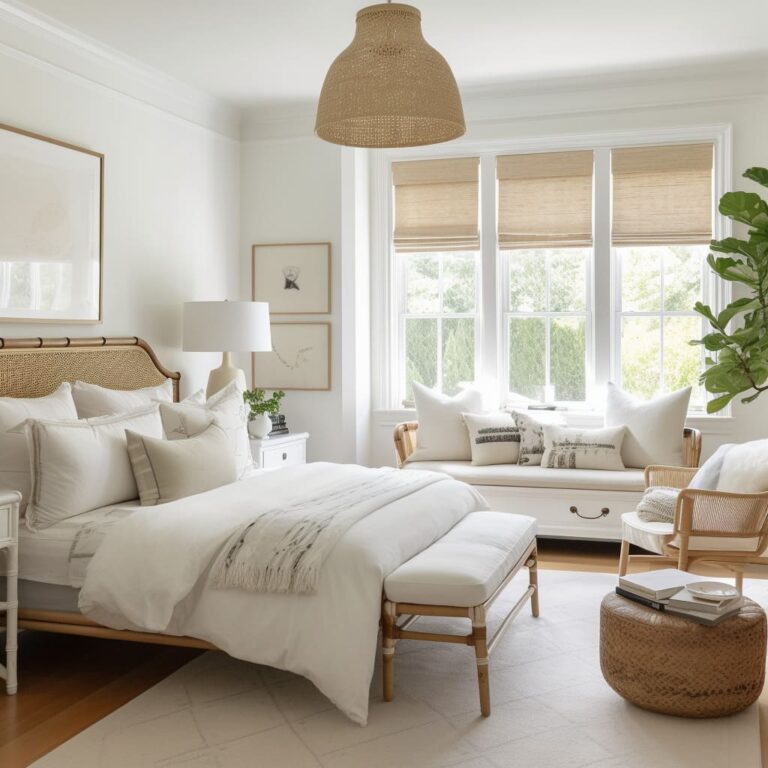
What are the coordinates of `green plant` in the screenshot? It's located at (720, 352).